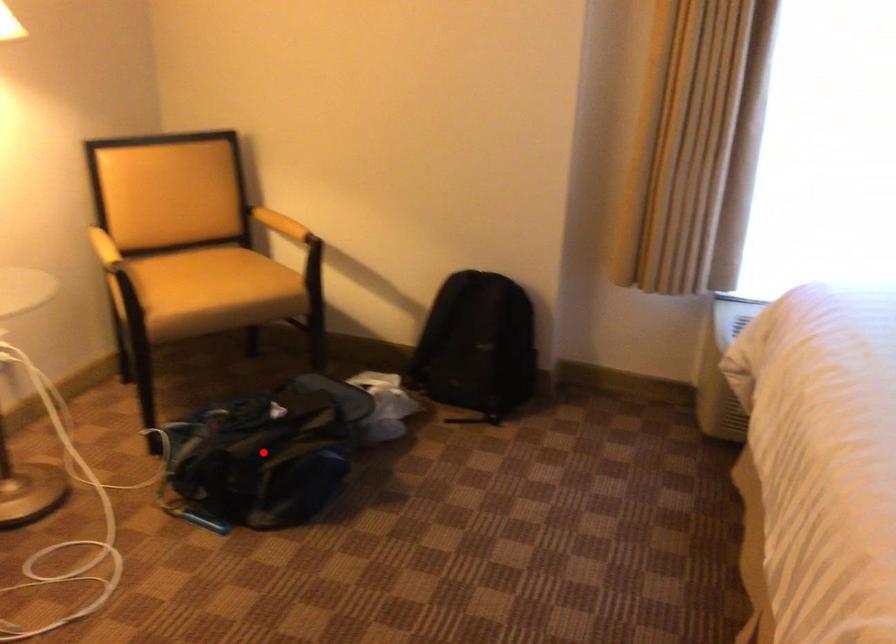
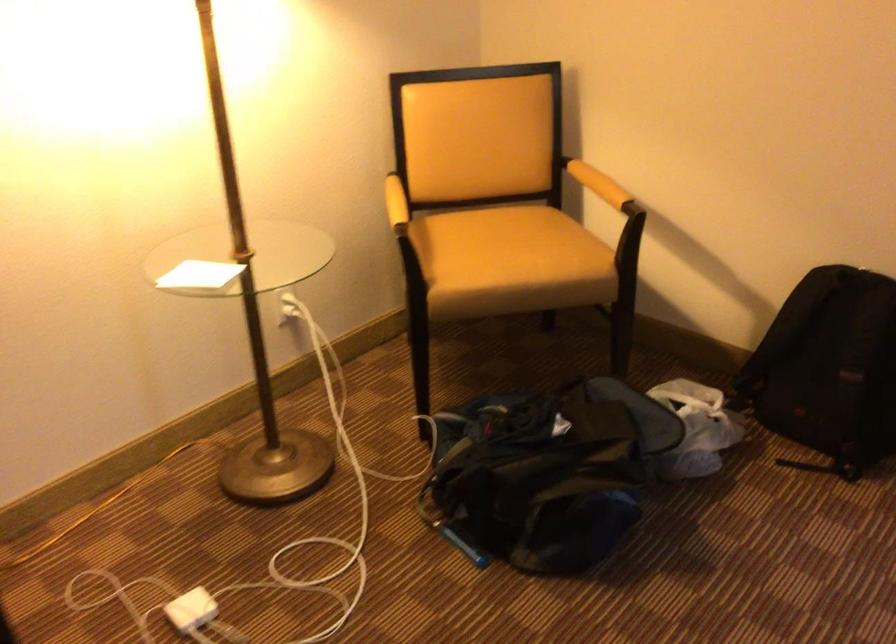
Where in the second image is the point corresponding to the highlighted location from the first image?

(537, 480)